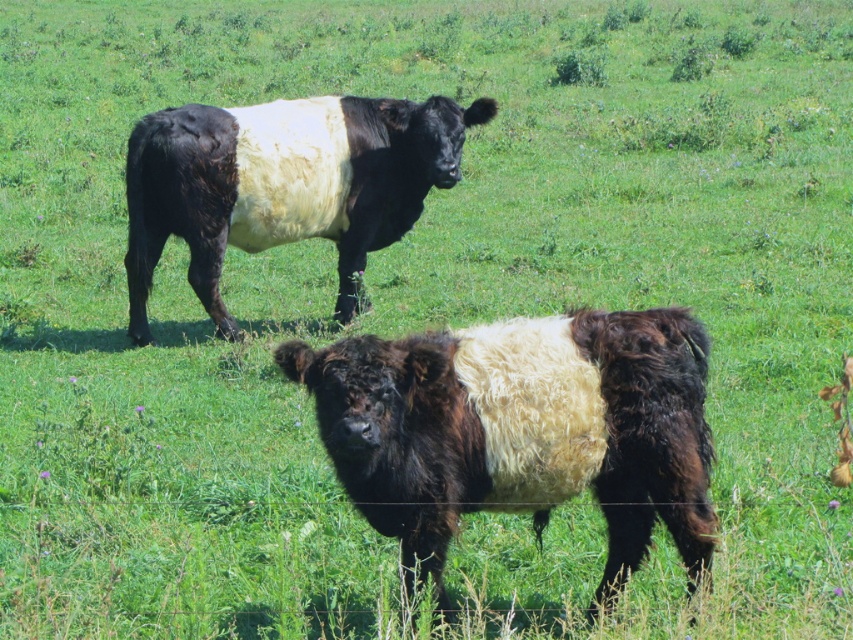
In the scene shown: Who is more distant from viewer, (679, 550) or (136, 196)?

The point (136, 196) is behind.

The image size is (853, 640). Find the location of `fuzzy brown and white bull at center`. fuzzy brown and white bull at center is located at coordinates (521, 428).